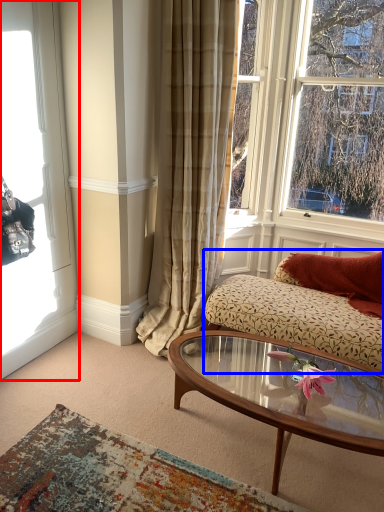
Question: Among these objects, which one is farthest to the camera, window (highlighted by a red box) or studio couch (highlighted by a blue box)?

Choices:
 (A) window
 (B) studio couch

Answer: (B)